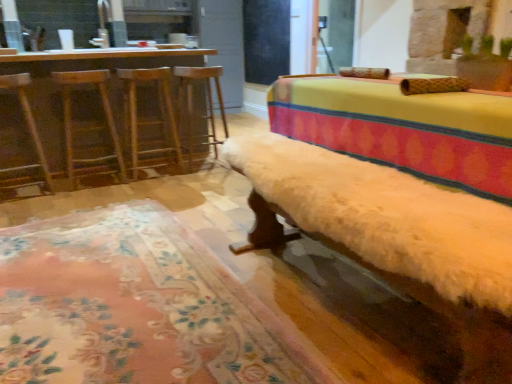
Question: Can you confirm if wooden bar stool at center, which is the first bar stool from right to left, is shorter than fuzzy white bench at center?

Choices:
 (A) no
 (B) yes

Answer: (A)

Question: From the image's perspective, would you say wooden bar stool at center, which is the first bar stool from right to left, is shown under fuzzy white bench at center?

Choices:
 (A) yes
 (B) no

Answer: (B)

Question: Would you consider wooden bar stool at center, which is the first bar stool from right to left, to be distant from fuzzy white bench at center?

Choices:
 (A) yes
 (B) no

Answer: (A)

Question: Can you confirm if wooden bar stool at center, which is the first bar stool from right to left, is smaller than fuzzy white bench at center?

Choices:
 (A) yes
 (B) no

Answer: (A)

Question: From a real-world perspective, is wooden bar stool at center, the 2th bar stool from the left, positioned under fuzzy white bench at center based on gravity?

Choices:
 (A) yes
 (B) no

Answer: (B)

Question: Could you tell me if wooden bar stool at center, which is the first bar stool from right to left, is facing fuzzy white bench at center?

Choices:
 (A) no
 (B) yes

Answer: (A)

Question: Can you confirm if wooden bar stool at left, placed as the 1th bar stool when sorted from left to right, is shorter than wooden swivel chair at left, the 1th swivel chair positioned from the right?

Choices:
 (A) yes
 (B) no

Answer: (A)

Question: Does wooden bar stool at left, placed as the 1th bar stool when sorted from left to right, appear on the left side of wooden swivel chair at left, the second swivel chair viewed from the left?

Choices:
 (A) yes
 (B) no

Answer: (B)

Question: Does wooden bar stool at left, the 2th bar stool from the right, have a lesser width compared to wooden swivel chair at left, the 1th swivel chair positioned from the right?

Choices:
 (A) no
 (B) yes

Answer: (B)

Question: Is wooden swivel chair at left, the second swivel chair viewed from the left, at the back of wooden bar stool at left, placed as the 1th bar stool when sorted from left to right?

Choices:
 (A) no
 (B) yes

Answer: (A)

Question: From the image's perspective, is wooden bar stool at left, the 2th bar stool from the right, under wooden swivel chair at left, the second swivel chair viewed from the left?

Choices:
 (A) no
 (B) yes

Answer: (A)

Question: Does wooden bar stool at left, the 2th bar stool from the right, have a greater height compared to wooden swivel chair at left, the second swivel chair viewed from the left?

Choices:
 (A) no
 (B) yes

Answer: (A)

Question: Is wooden bar stool at center, the 2th bar stool from the left, smaller than wooden swivel chair at left, marked as the 2th swivel chair in a right-to-left arrangement?

Choices:
 (A) yes
 (B) no

Answer: (B)